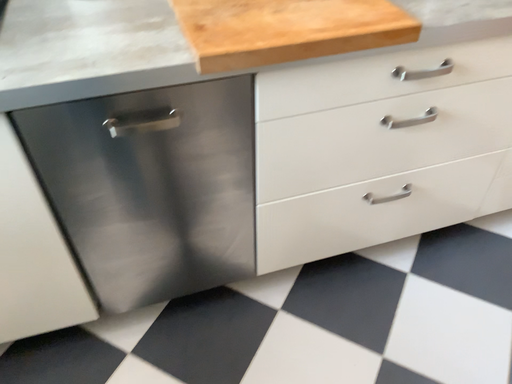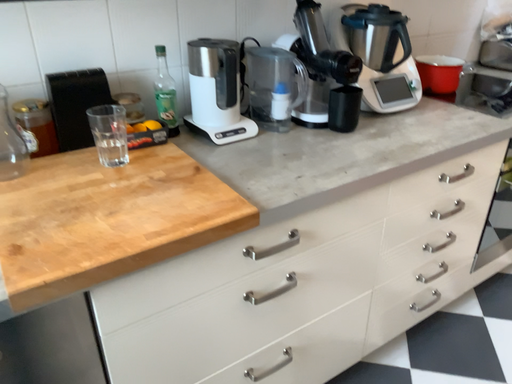
Question: How did the camera likely rotate when shooting the video?

Choices:
 (A) rotated downward
 (B) rotated upward

Answer: (B)